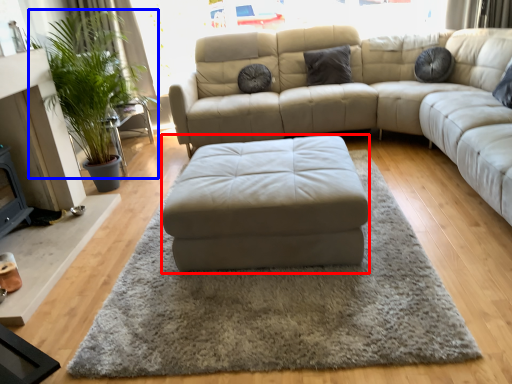
Question: Which object appears closest to the camera in this image, footrest (highlighted by a red box) or plant (highlighted by a blue box)?

Choices:
 (A) footrest
 (B) plant

Answer: (A)